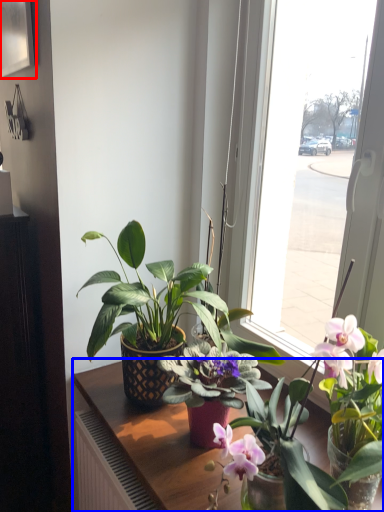
Question: Which object is closer to the camera taking this photo, picture frame (highlighted by a red box) or table (highlighted by a blue box)?

Choices:
 (A) picture frame
 (B) table

Answer: (B)